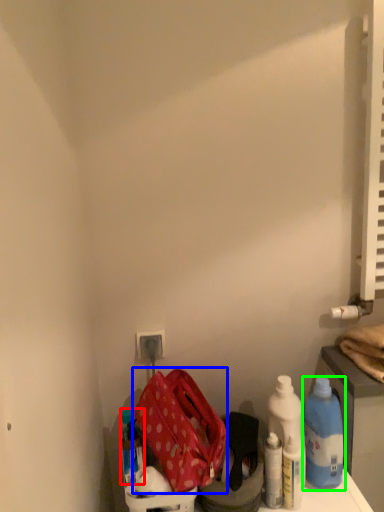
Question: Based on their relative distances, which object is farther from bottle (highlighted by a red box)? Choose from kit (highlighted by a blue box) and bottle (highlighted by a green box).

Choices:
 (A) kit
 (B) bottle

Answer: (B)